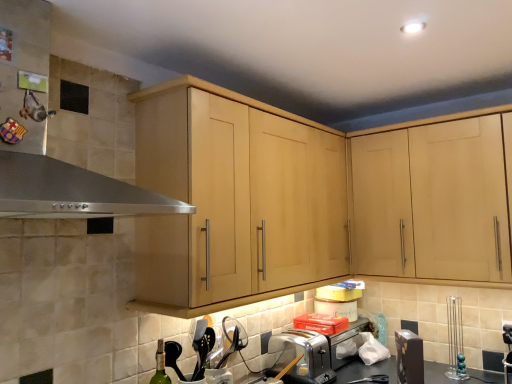
Image resolution: width=512 pixels, height=384 pixels. Describe the element at coordinates (409, 357) in the screenshot. I see `matte black toaster at lower center, the 2th appliance positioned from the back` at that location.

Locate an element on the screen. The width and height of the screenshot is (512, 384). matte black toaster at lower center, the first appliance from the front is located at coordinates (409, 357).

What is the approximate height of stainless steel exhaust hood at upper left?

The height of stainless steel exhaust hood at upper left is 60.64 centimeters.

Identify the location of green glass bottle at lower left. This screenshot has height=384, width=512. (160, 366).

You are a GUI agent. You are given a task and a screenshot of the screen. Output one action in this format:
    pyautogui.click(x=<x>, y=<y>)
    Task: Click on the light wood cabinet at upper right, acting as the second cabinetry starting from the left
    The image size is (512, 384).
    Given the screenshot: What is the action you would take?
    pyautogui.click(x=432, y=201)

Where is `matte black toaster at lower center, the 2th appliance positioned from the back`? The width and height of the screenshot is (512, 384). matte black toaster at lower center, the 2th appliance positioned from the back is located at coordinates (409, 357).

How many degrees apart are the facing directions of metallic silver utensil holder at right, which ranks as the 2th appliance in front-to-back order, and stainless steel exhaust hood at upper left?

The facing directions of metallic silver utensil holder at right, which ranks as the 2th appliance in front-to-back order, and stainless steel exhaust hood at upper left are 91.6 degrees apart.

Considering the sizes of metallic silver utensil holder at right, which appears as the first appliance when viewed from the right, and stainless steel exhaust hood at upper left in the image, is metallic silver utensil holder at right, which appears as the first appliance when viewed from the right, taller or shorter than stainless steel exhaust hood at upper left?

Clearly, metallic silver utensil holder at right, which appears as the first appliance when viewed from the right, is shorter compared to stainless steel exhaust hood at upper left.

In terms of size, does metallic silver utensil holder at right, which appears as the 1th appliance when viewed from the back, appear bigger or smaller than stainless steel exhaust hood at upper left?

metallic silver utensil holder at right, which appears as the 1th appliance when viewed from the back, is smaller than stainless steel exhaust hood at upper left.

At what (x,y) coordinates should I click in order to perform the action: click on exhaust hood above the metallic silver utensil holder at right, the second appliance from the left (from a real-world perspective). Please return your answer as a coordinate pair (x, y). The image size is (512, 384). Looking at the image, I should click on (67, 186).

Is stainless steel exhaust hood at upper left turned away from light wood cabinet at upper right, acting as the second cabinetry starting from the left?

No, stainless steel exhaust hood at upper left's orientation is not away from light wood cabinet at upper right, acting as the second cabinetry starting from the left.

In the scene shown: What's the angular difference between stainless steel exhaust hood at upper left and light wood cabinet at upper right, acting as the second cabinetry starting from the left,'s facing directions?

90.4 degrees.

Is stainless steel exhaust hood at upper left at the left side of light wood cabinet at upper right, acting as the second cabinetry starting from the left?

Indeed, stainless steel exhaust hood at upper left is positioned on the left side of light wood cabinet at upper right, acting as the second cabinetry starting from the left.

Are stainless steel exhaust hood at upper left and light wood cabinet at upper right, acting as the second cabinetry starting from the left, located far from each other?

Yes, stainless steel exhaust hood at upper left and light wood cabinet at upper right, acting as the second cabinetry starting from the left, are quite far apart.

From a real-world perspective, who is located higher, light wood cabinet at center, placed as the 1th cabinetry when sorted from left to right, or metallic silver utensil holder at right, which appears as the first appliance when viewed from the right?

light wood cabinet at center, placed as the 1th cabinetry when sorted from left to right, is physically above.

From the image's perspective, between light wood cabinet at center, the 2th cabinetry viewed from the right, and metallic silver utensil holder at right, which appears as the first appliance when viewed from the right, which one is located above?

light wood cabinet at center, the 2th cabinetry viewed from the right, is shown above in the image.

Does light wood cabinet at center, the 2th cabinetry viewed from the right, appear on the left side of metallic silver utensil holder at right, which appears as the first appliance when viewed from the right?

Yes, light wood cabinet at center, the 2th cabinetry viewed from the right, is to the left of metallic silver utensil holder at right, which appears as the first appliance when viewed from the right.

Could you tell me if light wood cabinet at center, placed as the 1th cabinetry when sorted from left to right, is turned towards metallic silver utensil holder at right, which appears as the first appliance when viewed from the right?

No, light wood cabinet at center, placed as the 1th cabinetry when sorted from left to right, is not aimed at metallic silver utensil holder at right, which appears as the first appliance when viewed from the right.

Does light wood cabinet at upper right, which is the 1th cabinetry in right-to-left order, have a greater height compared to green glass bottle at lower left?

Yes, light wood cabinet at upper right, which is the 1th cabinetry in right-to-left order, is taller than green glass bottle at lower left.

Who is smaller, light wood cabinet at upper right, which is the 1th cabinetry in right-to-left order, or green glass bottle at lower left?

Smaller between the two is green glass bottle at lower left.

Is light wood cabinet at upper right, acting as the second cabinetry starting from the left, next to green glass bottle at lower left and touching it?

No, light wood cabinet at upper right, acting as the second cabinetry starting from the left, is not making contact with green glass bottle at lower left.

Considering the points (476, 139) and (281, 364), which point is behind, point (476, 139) or point (281, 364)?

The point (281, 364) is more distant.

Could you measure the distance between light wood cabinet at upper right, which is the 1th cabinetry in right-to-left order, and satin silver toaster at lower center?

The distance of light wood cabinet at upper right, which is the 1th cabinetry in right-to-left order, from satin silver toaster at lower center is 28.77 inches.

Is light wood cabinet at upper right, acting as the second cabinetry starting from the left, beside satin silver toaster at lower center?

No.

Between light wood cabinet at upper right, which is the 1th cabinetry in right-to-left order, and satin silver toaster at lower center, which one has smaller width?

satin silver toaster at lower center is thinner.

Looking at their sizes, would you say light wood cabinet at center, placed as the 1th cabinetry when sorted from left to right, is wider or thinner than satin silver toaster at lower center?

Answer: Clearly, light wood cabinet at center, placed as the 1th cabinetry when sorted from left to right, has more width compared to satin silver toaster at lower center.

Considering the sizes of light wood cabinet at center, the 2th cabinetry viewed from the right, and satin silver toaster at lower center in the image, is light wood cabinet at center, the 2th cabinetry viewed from the right, taller or shorter than satin silver toaster at lower center?

Considering their sizes, light wood cabinet at center, the 2th cabinetry viewed from the right, has more height than satin silver toaster at lower center.

Who is smaller, light wood cabinet at center, the 2th cabinetry viewed from the right, or satin silver toaster at lower center?

satin silver toaster at lower center is smaller.

Looking at this image, how many degrees apart are the facing directions of light wood cabinet at center, the 2th cabinetry viewed from the right, and satin silver toaster at lower center?

3.61 degrees.

Could you tell me if matte black toaster at lower center, the 2th appliance positioned from the back, is turned towards light wood cabinet at upper right, which is the 1th cabinetry in right-to-left order?

No.

From a real-world perspective, is matte black toaster at lower center, which is the second appliance from right to left, physically below light wood cabinet at upper right, which is the 1th cabinetry in right-to-left order?

Yes, from a real-world perspective, matte black toaster at lower center, which is the second appliance from right to left, is under light wood cabinet at upper right, which is the 1th cabinetry in right-to-left order.

How far apart are matte black toaster at lower center, the first appliance from the front, and light wood cabinet at upper right, acting as the second cabinetry starting from the left?

matte black toaster at lower center, the first appliance from the front, is 24.58 inches away from light wood cabinet at upper right, acting as the second cabinetry starting from the left.

Image resolution: width=512 pixels, height=384 pixels. What are the coordinates of `appliance that is the 2nd one when counting rightward from the stainless steel exhaust hood at upper left` in the screenshot? It's located at (455, 340).

This screenshot has height=384, width=512. I want to click on the 2nd cabinetry positioned below the stainless steel exhaust hood at upper left (from the image's perspective), so click(x=432, y=201).

Looking at the image, which one is located further to stainless steel exhaust hood at upper left, light wood cabinet at upper right, which is the 1th cabinetry in right-to-left order, or matte black toaster at lower center, marked as the 1th appliance in a left-to-right arrangement?

matte black toaster at lower center, marked as the 1th appliance in a left-to-right arrangement, is positioned further to the anchor stainless steel exhaust hood at upper left.

Looking at the image, which one is located closer to matte black toaster at lower center, which is the second appliance from right to left, metallic silver utensil holder at right, which appears as the first appliance when viewed from the right, or stainless steel exhaust hood at upper left?

Based on the image, metallic silver utensil holder at right, which appears as the first appliance when viewed from the right, appears to be nearer to matte black toaster at lower center, which is the second appliance from right to left.

Which object lies further to the anchor point light wood cabinet at upper right, which is the 1th cabinetry in right-to-left order, stainless steel exhaust hood at upper left or satin silver toaster at lower center?

stainless steel exhaust hood at upper left.

Which object lies further to the anchor point light wood cabinet at upper right, acting as the second cabinetry starting from the left, stainless steel exhaust hood at upper left or light wood cabinet at center, the 2th cabinetry viewed from the right?

stainless steel exhaust hood at upper left is positioned further to the anchor light wood cabinet at upper right, acting as the second cabinetry starting from the left.

When comparing their distances from metallic silver utensil holder at right, the second appliance from the left, does light wood cabinet at upper right, which is the 1th cabinetry in right-to-left order, or satin silver toaster at lower center seem further?

satin silver toaster at lower center lies further to metallic silver utensil holder at right, the second appliance from the left, than the other object.

From the picture: From the image, which object appears to be farther from light wood cabinet at center, placed as the 1th cabinetry when sorted from left to right, matte black toaster at lower center, the 2th appliance positioned from the back, or green glass bottle at lower left?

Based on the image, green glass bottle at lower left appears to be further to light wood cabinet at center, placed as the 1th cabinetry when sorted from left to right.

Considering their positions, is metallic silver utensil holder at right, which appears as the 1th appliance when viewed from the back, positioned closer to matte black toaster at lower center, marked as the 1th appliance in a left-to-right arrangement, than light wood cabinet at center, the 2th cabinetry viewed from the right?

metallic silver utensil holder at right, which appears as the 1th appliance when viewed from the back, lies closer to matte black toaster at lower center, marked as the 1th appliance in a left-to-right arrangement, than the other object.

Which object lies further to the anchor point light wood cabinet at center, the 2th cabinetry viewed from the right, metallic silver utensil holder at right, the second appliance from the left, or green glass bottle at lower left?

metallic silver utensil holder at right, the second appliance from the left.

Find the location of a particular element. toaster located between green glass bottle at lower left and metallic silver utensil holder at right, which appears as the first appliance when viewed from the right, in the left-right direction is located at coordinates (310, 354).

Locate an element on the screen. toaster located between green glass bottle at lower left and light wood cabinet at upper right, acting as the second cabinetry starting from the left, in the left-right direction is located at coordinates (310, 354).

Locate an element on the screen. This screenshot has width=512, height=384. cabinetry situated between green glass bottle at lower left and light wood cabinet at upper right, which is the 1th cabinetry in right-to-left order, from left to right is located at coordinates (309, 199).

Where is `appliance between light wood cabinet at center, the 2th cabinetry viewed from the right, and metallic silver utensil holder at right, which ranks as the 2th appliance in front-to-back order, in the horizontal direction`? appliance between light wood cabinet at center, the 2th cabinetry viewed from the right, and metallic silver utensil holder at right, which ranks as the 2th appliance in front-to-back order, in the horizontal direction is located at coordinates (409, 357).